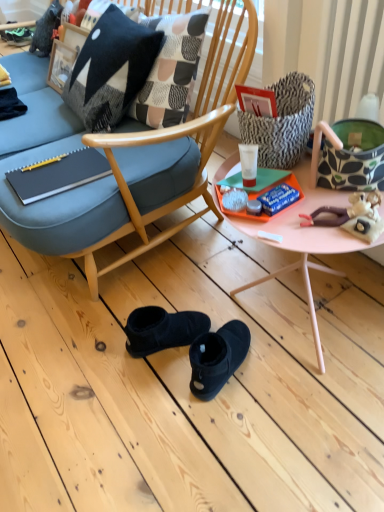
Question: Does white glossy cream at center have a greater height compared to matte black notebook at left?

Choices:
 (A) no
 (B) yes

Answer: (B)

Question: Is white glossy cream at center not within matte black notebook at left?

Choices:
 (A) no
 (B) yes

Answer: (B)

Question: From the image's perspective, is white glossy cream at center on matte black notebook at left?

Choices:
 (A) no
 (B) yes

Answer: (A)

Question: Can you confirm if white glossy cream at center is wider than matte black notebook at left?

Choices:
 (A) yes
 (B) no

Answer: (B)

Question: Is white glossy cream at center at the left side of matte black notebook at left?

Choices:
 (A) no
 (B) yes

Answer: (A)

Question: From a real-world perspective, relative to patterned fabric handbag at upper right, which is counted as the first handbag, starting from the left, is plush doll at right vertically above or below?

Choices:
 (A) below
 (B) above

Answer: (A)

Question: Is plush doll at right in front of or behind patterned fabric handbag at upper right, which is counted as the first handbag, starting from the left, in the image?

Choices:
 (A) front
 (B) behind

Answer: (A)

Question: From the image's perspective, is plush doll at right positioned above or below patterned fabric handbag at upper right, which is counted as the first handbag, starting from the left?

Choices:
 (A) above
 (B) below

Answer: (B)

Question: Considering the positions of plush doll at right and patterned fabric handbag at upper right, acting as the 2th handbag starting from the right, in the image, is plush doll at right wider or thinner than patterned fabric handbag at upper right, acting as the 2th handbag starting from the right,?

Choices:
 (A) wide
 (B) thin

Answer: (A)

Question: In the image, is black woolen pillow at upper left positioned in front of or behind white glossy cream at center?

Choices:
 (A) front
 (B) behind

Answer: (B)

Question: Considering the positions of black woolen pillow at upper left and white glossy cream at center in the image, is black woolen pillow at upper left wider or thinner than white glossy cream at center?

Choices:
 (A) thin
 (B) wide

Answer: (B)

Question: Considering the relative positions of black woolen pillow at upper left and white glossy cream at center in the image provided, is black woolen pillow at upper left to the left or to the right of white glossy cream at center?

Choices:
 (A) left
 (B) right

Answer: (A)

Question: Is black woolen pillow at upper left situated inside white glossy cream at center or outside?

Choices:
 (A) inside
 (B) outside

Answer: (B)

Question: Relative to matte black notebook at left, is patterned fabric handbag at upper right, which is counted as the first handbag, starting from the left, in front or behind?

Choices:
 (A) front
 (B) behind

Answer: (A)

Question: Considering the positions of patterned fabric handbag at upper right, acting as the 2th handbag starting from the right, and matte black notebook at left in the image, is patterned fabric handbag at upper right, acting as the 2th handbag starting from the right, wider or thinner than matte black notebook at left?

Choices:
 (A) thin
 (B) wide

Answer: (A)